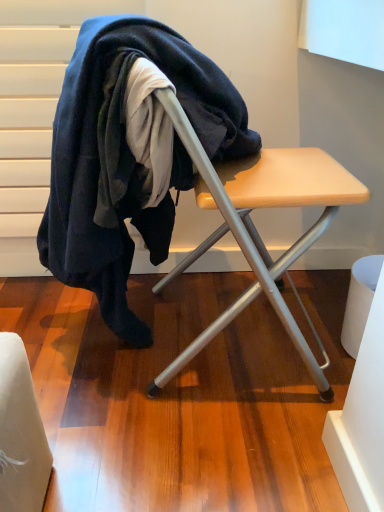
What do you see at coordinates (292, 206) in the screenshot? I see `wooden table at center` at bounding box center [292, 206].

Image resolution: width=384 pixels, height=512 pixels. I want to click on wooden table at center, so (x=292, y=206).

Describe the element at coordinates (129, 154) in the screenshot. I see `dark blue wool at center` at that location.

In order to face dark blue wool at center, should I rotate leftwards or rightwards?

To align with it, rotate left about 5.750°.

The width and height of the screenshot is (384, 512). In order to click on dark blue wool at center in this screenshot , I will do click(129, 154).

The image size is (384, 512). Find the location of `wooden table at center`. wooden table at center is located at coordinates (292, 206).

Is wooden table at center to the left or to the right of dark blue wool at center in the image?

From the image, it's evident that wooden table at center is to the right of dark blue wool at center.

Is wooden table at center behind dark blue wool at center?

No, wooden table at center is in front of dark blue wool at center.

Which is in front, point (270, 203) or point (73, 117)?

Point (73, 117)

From the image's perspective, between wooden table at center and dark blue wool at center, which one is located above?

From the image's view, dark blue wool at center is above.

From a real-world perspective, is wooden table at center physically below dark blue wool at center?

Yes, from a real-world perspective, wooden table at center is under dark blue wool at center.

Considering the relative sizes of wooden table at center and dark blue wool at center in the image provided, is wooden table at center wider than dark blue wool at center?

In fact, wooden table at center might be narrower than dark blue wool at center.

In the scene shown: Who is shorter, wooden table at center or dark blue wool at center?

wooden table at center.

Consider the image. Considering the relative sizes of wooden table at center and dark blue wool at center in the image provided, is wooden table at center bigger than dark blue wool at center?

No, wooden table at center is not bigger than dark blue wool at center.

Does wooden table at center contain dark blue wool at center?

Yes, wooden table at center contains dark blue wool at center.

Is wooden table at center positioned far away from dark blue wool at center?

No, there isn't a large distance between wooden table at center and dark blue wool at center.

Consider the image. Is wooden table at center facing towards dark blue wool at center?

Yes.

Locate an element on the screen. This screenshot has height=512, width=384. wool behind the wooden table at center is located at coordinates (129, 154).

Between dark blue wool at center and wooden table at center, which one appears on the left side from the viewer's perspective?

From the viewer's perspective, dark blue wool at center appears more on the left side.

Which object is further away from the camera, dark blue wool at center or wooden table at center?

dark blue wool at center.

Which is less distant, (x=139, y=75) or (x=326, y=387)?

Point (x=139, y=75) is positioned closer to the camera compared to point (x=326, y=387).

From the image's perspective, is dark blue wool at center on wooden table at center?

Yes.

Looking at this image, from a real-world perspective, who is located higher, dark blue wool at center or wooden table at center?

From a 3D spatial view, dark blue wool at center is above.

Is dark blue wool at center wider than wooden table at center?

Yes, dark blue wool at center is wider than wooden table at center.

Considering the sizes of objects dark blue wool at center and wooden table at center in the image provided, who is taller, dark blue wool at center or wooden table at center?

dark blue wool at center.

Based on the photo, looking at the image, does dark blue wool at center seem bigger or smaller compared to wooden table at center?

Considering their sizes, dark blue wool at center takes up more space than wooden table at center.

Is dark blue wool at center completely or partially outside of wooden table at center?

No.

Is dark blue wool at center not close to wooden table at center?

No, dark blue wool at center is not far from wooden table at center.

Is dark blue wool at center oriented towards wooden table at center?

Yes, dark blue wool at center is aimed at wooden table at center.

This screenshot has height=512, width=384. I want to click on table below the dark blue wool at center (from a real-world perspective), so click(x=292, y=206).

This screenshot has height=512, width=384. I want to click on table in front of the dark blue wool at center, so click(292, 206).

Where is `table that appears below the dark blue wool at center (from the image's perspective)`? The width and height of the screenshot is (384, 512). table that appears below the dark blue wool at center (from the image's perspective) is located at coordinates [x=292, y=206].